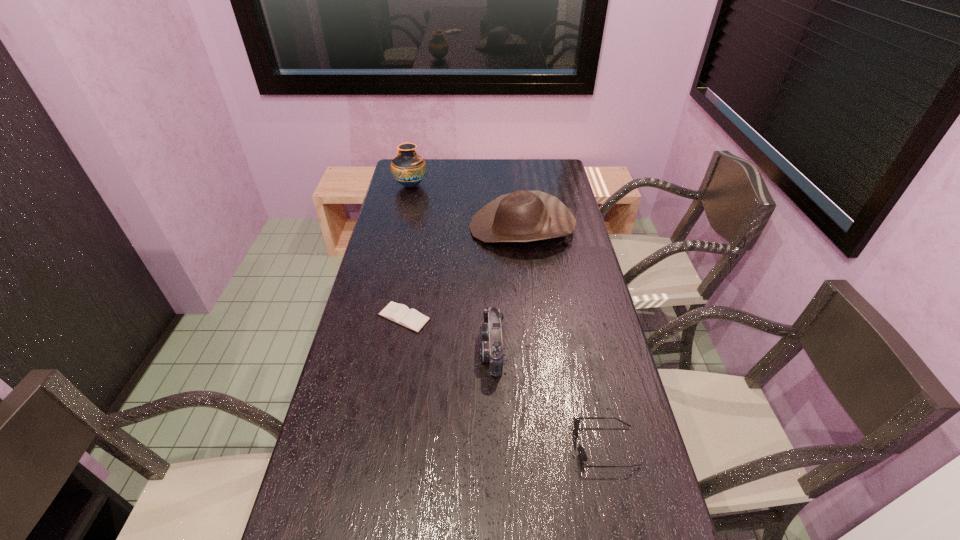
Where is `cowboy hat situated at the right edge`? cowboy hat situated at the right edge is located at coordinates (522, 216).

The height and width of the screenshot is (540, 960). In order to click on sunglasses that is at the right edge in this screenshot , I will do `click(582, 455)`.

Where is `object present at the far left corner`? The width and height of the screenshot is (960, 540). object present at the far left corner is located at coordinates (408, 168).

The width and height of the screenshot is (960, 540). In the image, there is a desktop. Identify the location of free space at the far edge. (452, 170).

Find the location of a particular element. free point at the left edge is located at coordinates (362, 361).

Find the location of a particular element. The image size is (960, 540). blank space at the right edge of the desktop is located at coordinates (586, 507).

The image size is (960, 540). In the image, there is a desktop. Identify the location of vacant space at the far right corner. (537, 163).

Find the location of a particular element. vacant point located between the fourth tallest object and the second tallest object is located at coordinates (564, 337).

Where is `vacant region between the diary and the camcorder`? This screenshot has width=960, height=540. vacant region between the diary and the camcorder is located at coordinates (448, 333).

Image resolution: width=960 pixels, height=540 pixels. What are the coordinates of `vacant area that lies between the shortest object and the nearest object` in the screenshot? It's located at (505, 382).